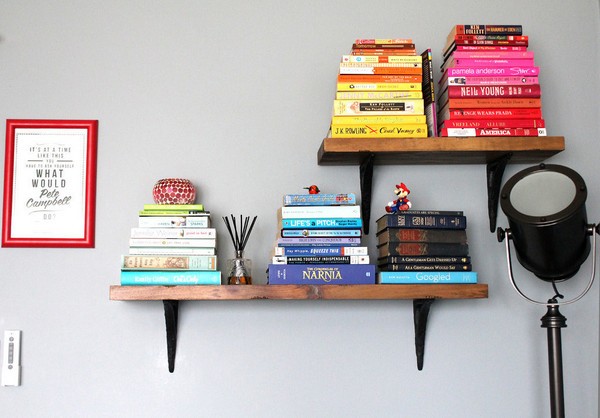
You are a GUI agent. You are given a task and a screenshot of the screen. Output one action in this format:
    pyautogui.click(x=<x>, y=<y>)
    Task: Click on the red books
    This screenshot has width=600, height=418.
    Given the screenshot: What is the action you would take?
    pyautogui.click(x=519, y=132), pyautogui.click(x=508, y=124), pyautogui.click(x=519, y=113), pyautogui.click(x=504, y=92), pyautogui.click(x=469, y=44), pyautogui.click(x=460, y=38), pyautogui.click(x=458, y=29)